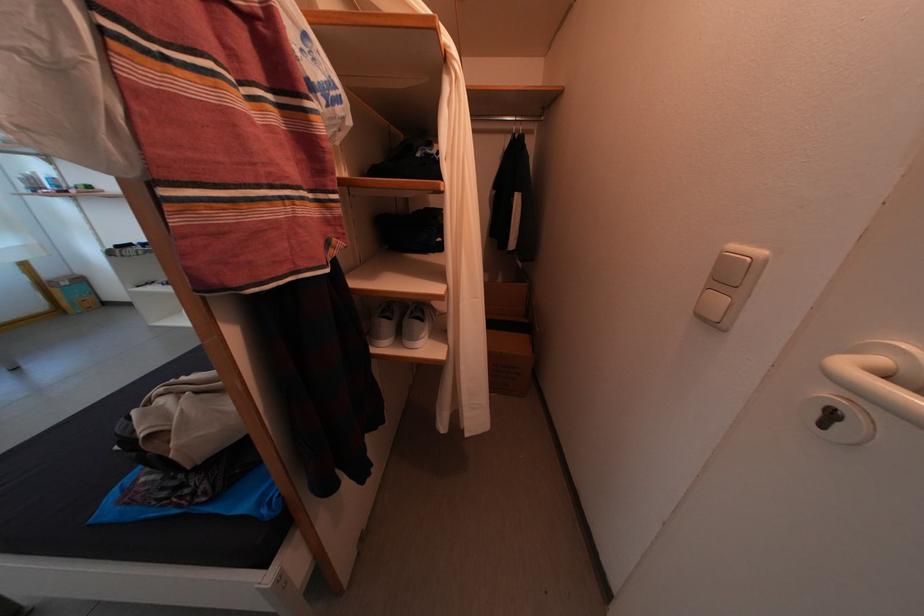
The height and width of the screenshot is (616, 924). What are the coordinates of `closet hanger rod` in the screenshot? It's located at (516, 126).